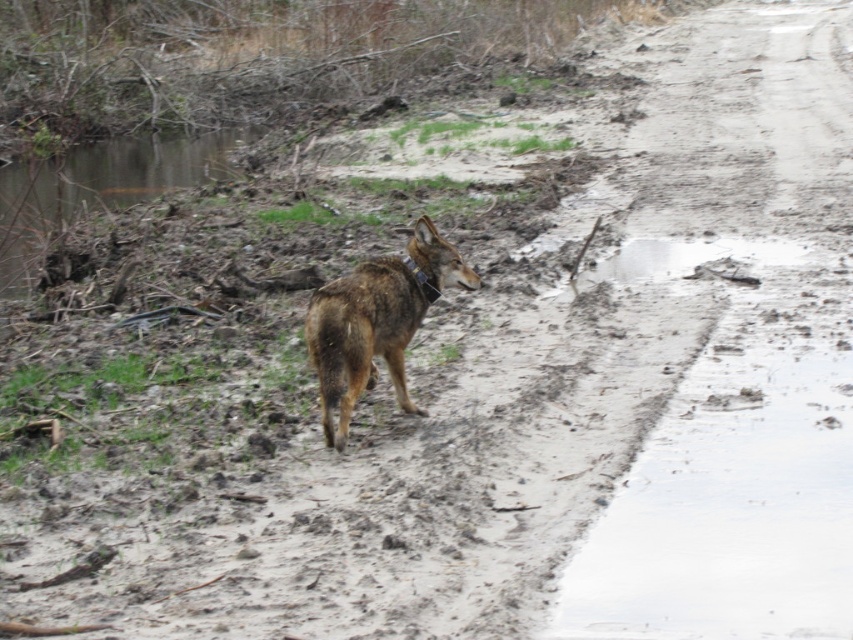
Question: Does brown fur dog at center appear on the left side of brown muddy water at upper left?

Choices:
 (A) no
 (B) yes

Answer: (A)

Question: Is brown fur dog at center smaller than brown muddy water at upper left?

Choices:
 (A) no
 (B) yes

Answer: (B)

Question: Which point is farther to the camera?

Choices:
 (A) brown fur dog at center
 (B) brown muddy water at upper left

Answer: (B)

Question: Which point is farther to the camera?

Choices:
 (A) (36, 208)
 (B) (368, 330)

Answer: (A)

Question: Does brown fur dog at center have a smaller size compared to brown muddy water at upper left?

Choices:
 (A) yes
 (B) no

Answer: (A)

Question: Which object appears closest to the camera in this image?

Choices:
 (A) brown muddy water at upper left
 (B) brown fur dog at center

Answer: (B)